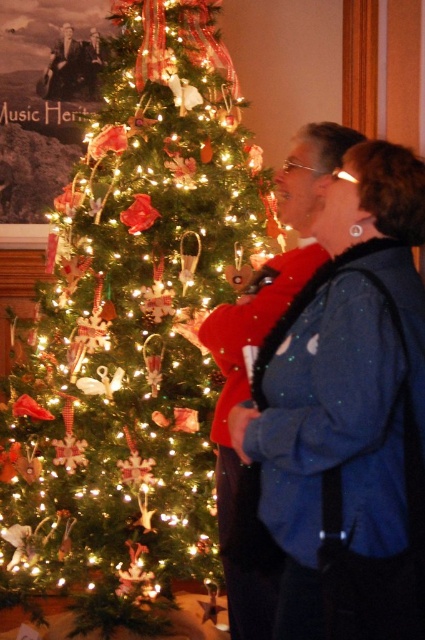
Question: Where is green matte christmas tree at left located in relation to blue sequined jacket at center in the image?

Choices:
 (A) left
 (B) right

Answer: (A)

Question: Is green matte christmas tree at left behind blue sequined jacket at center?

Choices:
 (A) yes
 (B) no

Answer: (A)

Question: Which point is closer to the camera taking this photo?

Choices:
 (A) (331, 259)
 (B) (184, 429)

Answer: (A)

Question: Is green matte christmas tree at left positioned at the back of blue sequined jacket at center?

Choices:
 (A) yes
 (B) no

Answer: (A)